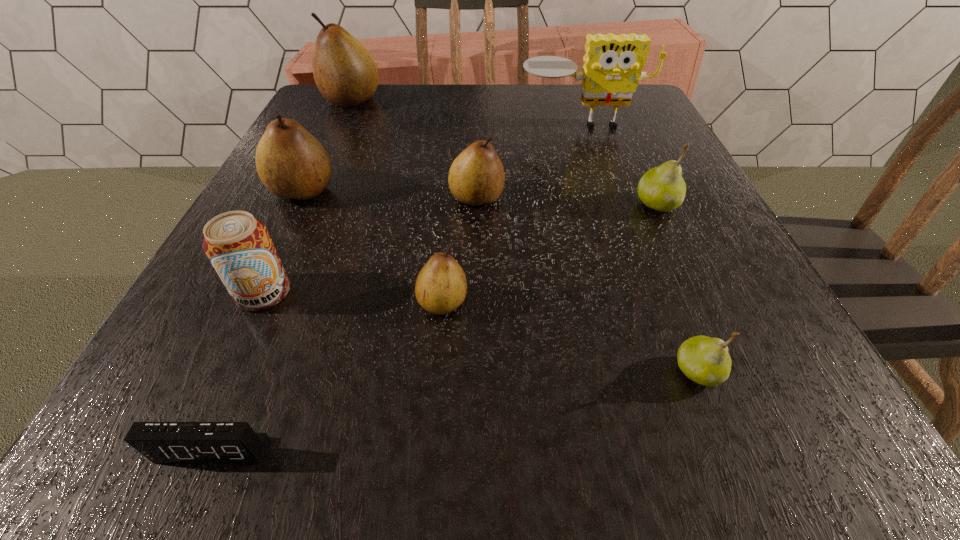
Choose which brown pear is the nearest neighbor to the second tallest pear. Please provide its 2D coordinates. Your answer should be formatted as a tuple, i.e. [(x, y)], where the tuple contains the x and y coordinates of a point satisfying the conditions above.

[(476, 177)]

You are a GUI agent. You are given a task and a screenshot of the screen. Output one action in this format:
    pyautogui.click(x=<x>, y=<y>)
    Task: Click on the brown pear that is the third closest to the biggest brown pear
    The image size is (960, 540).
    Given the screenshot: What is the action you would take?
    pyautogui.click(x=441, y=286)

Identify the location of free point that satisfies the following two spatial constraints: 1. on the front side of the smaller green pear; 2. on the right side of the second smallest brown pear. (475, 372).

This screenshot has height=540, width=960. Find the location of `free location that satisfies the following two spatial constraints: 1. on the front-facing side of the farther green pear; 2. on the left side of the yellow sponge`. free location that satisfies the following two spatial constraints: 1. on the front-facing side of the farther green pear; 2. on the left side of the yellow sponge is located at coordinates (611, 204).

The image size is (960, 540). What are the coordinates of `vacant space that satisfies the following two spatial constraints: 1. on the front side of the nearest brown pear; 2. on the right side of the beer can` in the screenshot? It's located at (259, 302).